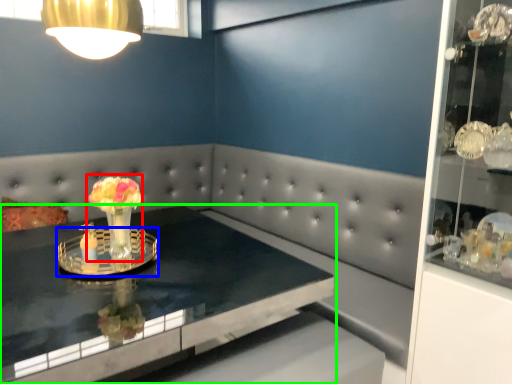
Question: Estimate the real-world distances between objects in this image. Which object is closer to floral arrangement (highlighted by a red box), glass plate (highlighted by a blue box) or table (highlighted by a green box)?

Choices:
 (A) glass plate
 (B) table

Answer: (A)